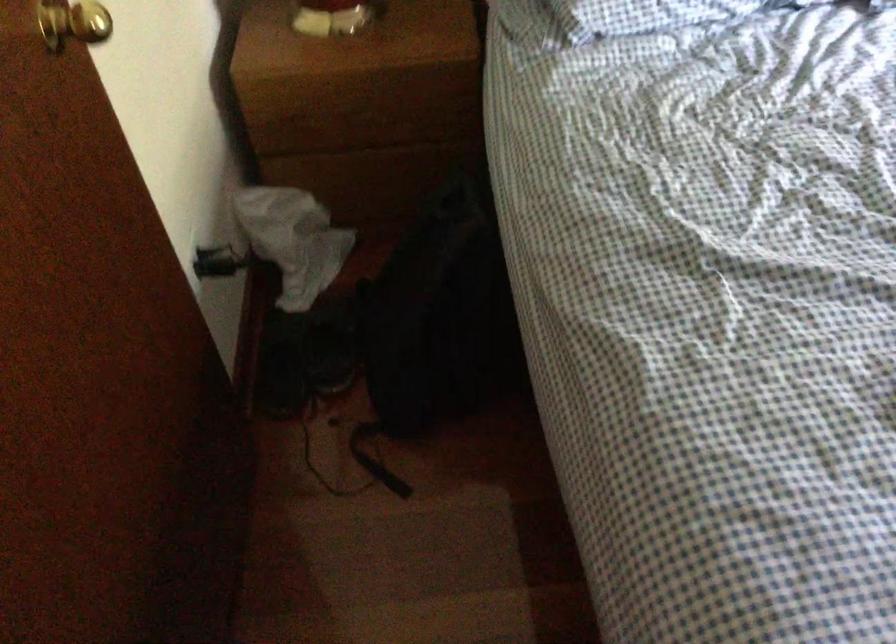
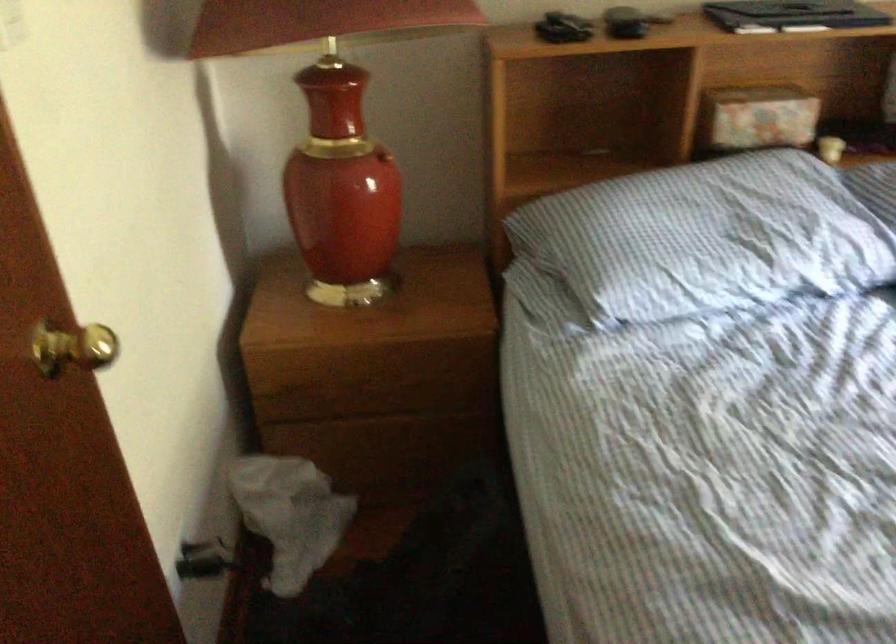
In a continuous first-person perspective shot, in which direction is the camera moving?

The cameraman walked toward left, forward.